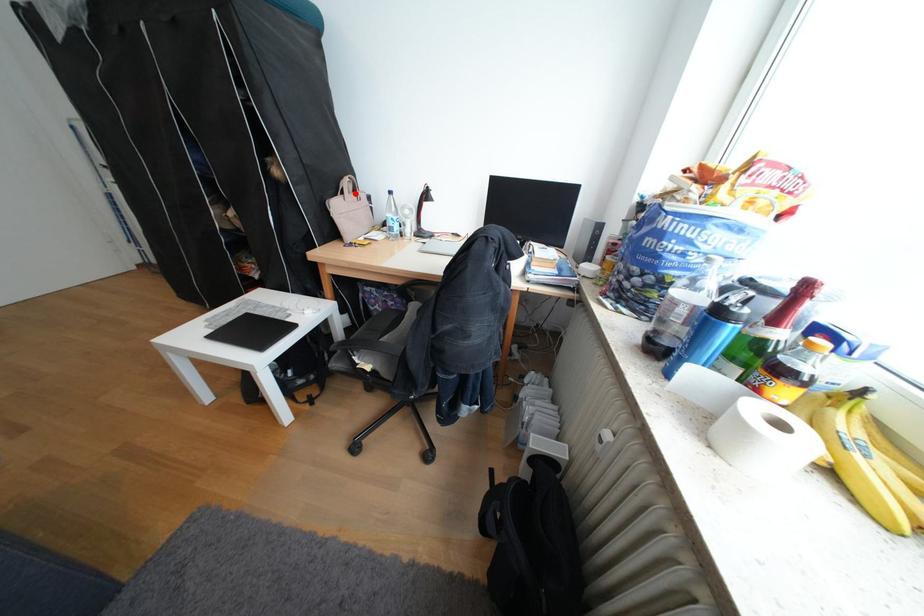
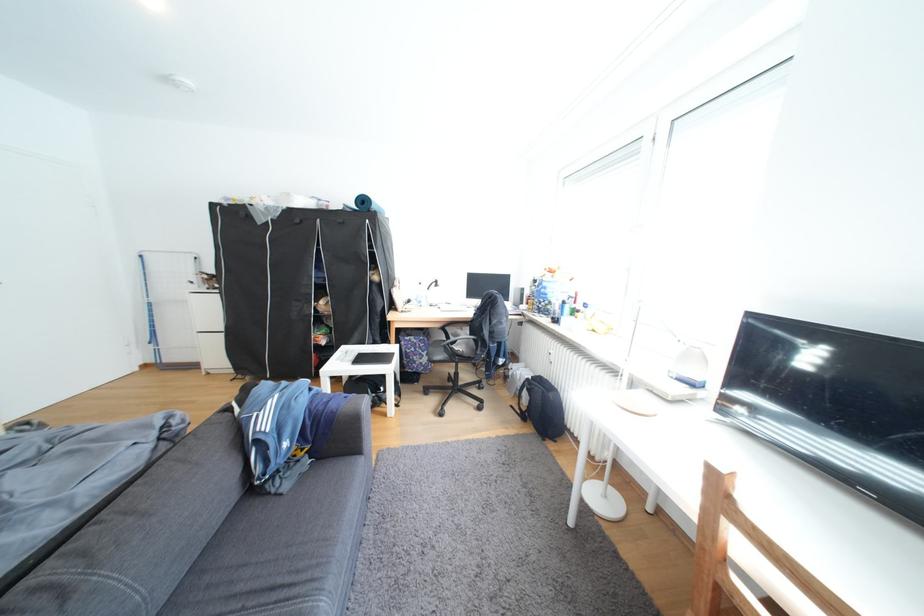
Question: I am providing you with two images of the same scene from different viewpoints. Given a red point in image1, look at the same physical point in image2. Is it:

Choices:
 (A) Closer to the viewpoint
 (B) Farther from the viewpoint

Answer: (B)